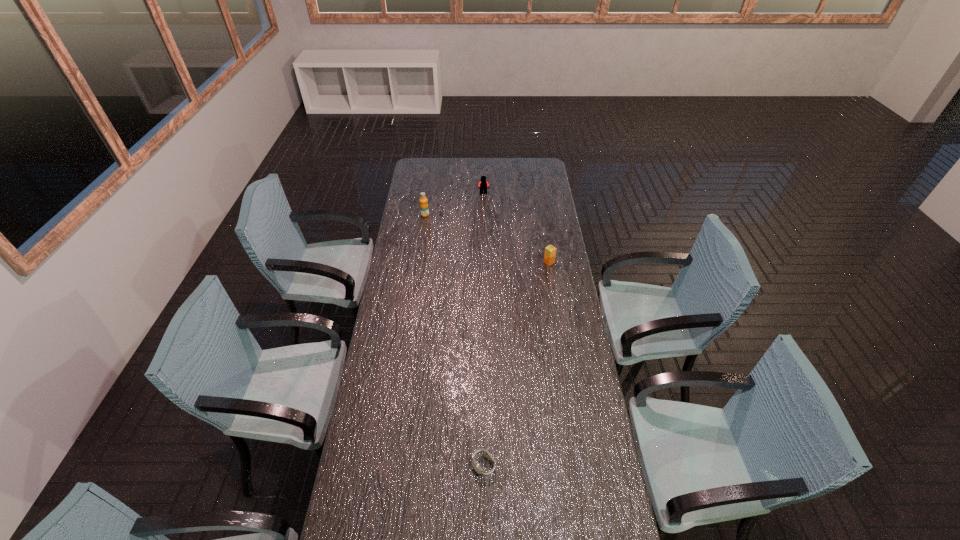
Identify the location of empty space that is in between the nearest object and the rightmost object. (516, 363).

Locate which object ranks third in proximity to the third nearest object. Please provide its 2D coordinates. Your answer should be formatted as a tuple, i.e. [(x, y)], where the tuple contains the x and y coordinates of a point satisfying the conditions above.

[(476, 466)]

Where is `object that is the third closest to the watch`? object that is the third closest to the watch is located at coordinates (483, 184).

This screenshot has width=960, height=540. In order to click on vacant region that satisfies the following two spatial constraints: 1. on the label of the left orange juice; 2. on the left side of the right orange juice in this screenshot , I will do `click(419, 262)`.

Identify the location of free point that satisfies the following two spatial constraints: 1. on the label of the leftmost object; 2. on the right side of the third farthest object. (419, 262).

This screenshot has width=960, height=540. I want to click on vacant space that satisfies the following two spatial constraints: 1. on the front-facing side of the farthest object; 2. on the left side of the shorter orange juice, so click(x=485, y=262).